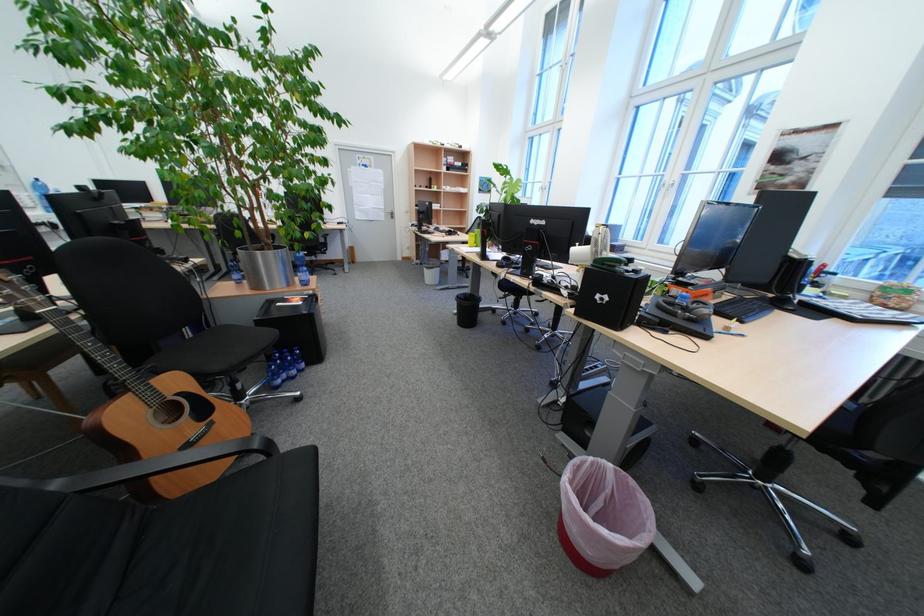
Where is `yellow travel mug`? This screenshot has height=616, width=924. yellow travel mug is located at coordinates (472, 238).